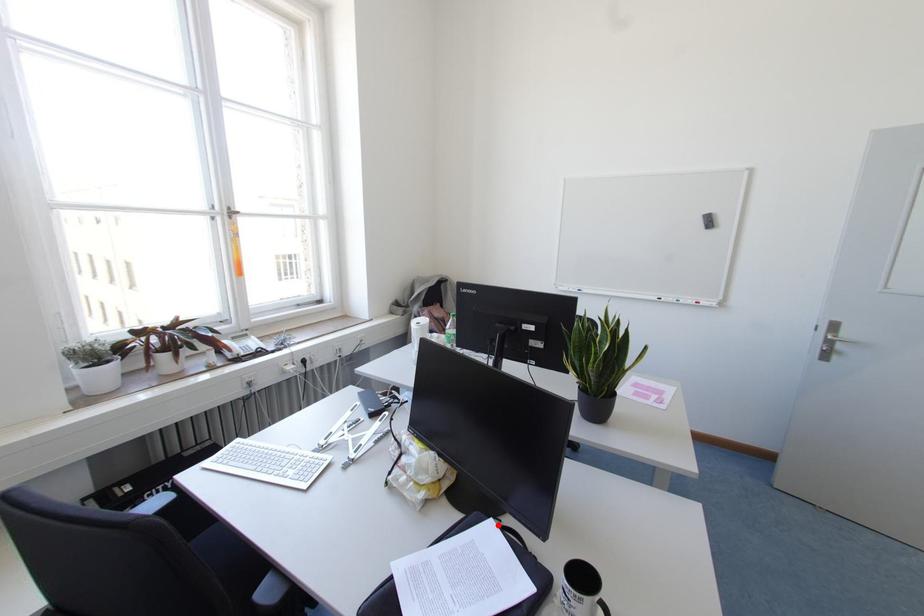
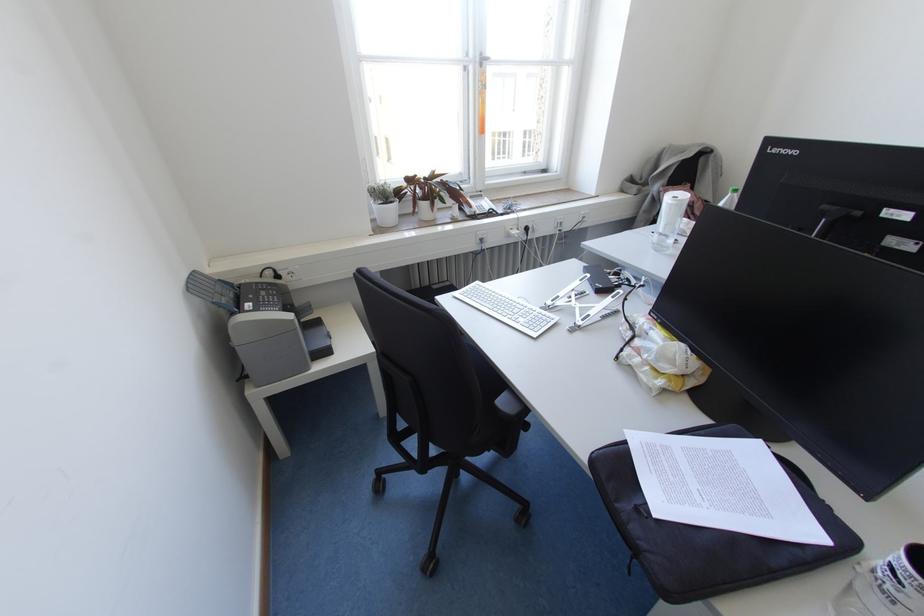
Question: I am providing you with two images of the same scene from different viewpoints. In image1, a red point is highlighted. Considering the same 3D point in image2, which of the following is correct?

Choices:
 (A) It is closer
 (B) It is farther

Answer: (A)